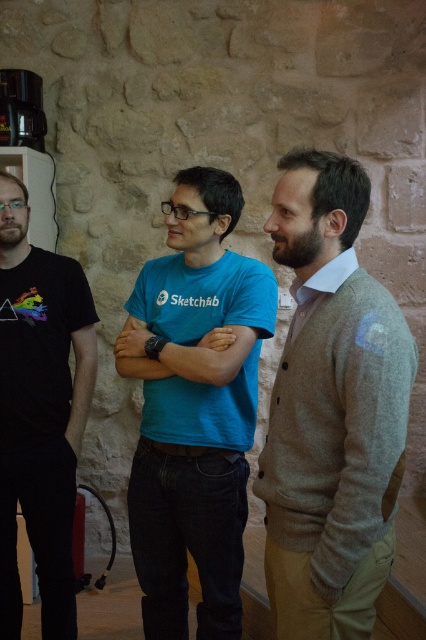
Which is behind, point (345, 298) or point (244, 465)?

Positioned behind is point (244, 465).

Is light brown cardigan at center smaller than blue cotton shirt at center?

Correct, light brown cardigan at center occupies less space than blue cotton shirt at center.

Is point (279, 211) closer to camera compared to point (161, 381)?

Yes.

Where is `light brown cardigan at center`? light brown cardigan at center is located at coordinates (331, 410).

Between light brown cardigan at center and matte blue t-shirt at center, which one has less height?

matte blue t-shirt at center

Is light brown cardigan at center to the right of matte blue t-shirt at center from the viewer's perspective?

Indeed, light brown cardigan at center is positioned on the right side of matte blue t-shirt at center.

Is point (301, 481) more distant than point (175, 364)?

No, (301, 481) is closer to viewer.

This screenshot has height=640, width=426. Find the location of `light brown cardigan at center`. light brown cardigan at center is located at coordinates (331, 410).

Can you confirm if light brown cardigan at center is taller than black matte t-shirt at left?

In fact, light brown cardigan at center may be shorter than black matte t-shirt at left.

Which is below, light brown cardigan at center or black matte t-shirt at left?

black matte t-shirt at left

Locate an element on the screen. light brown cardigan at center is located at coordinates (331, 410).